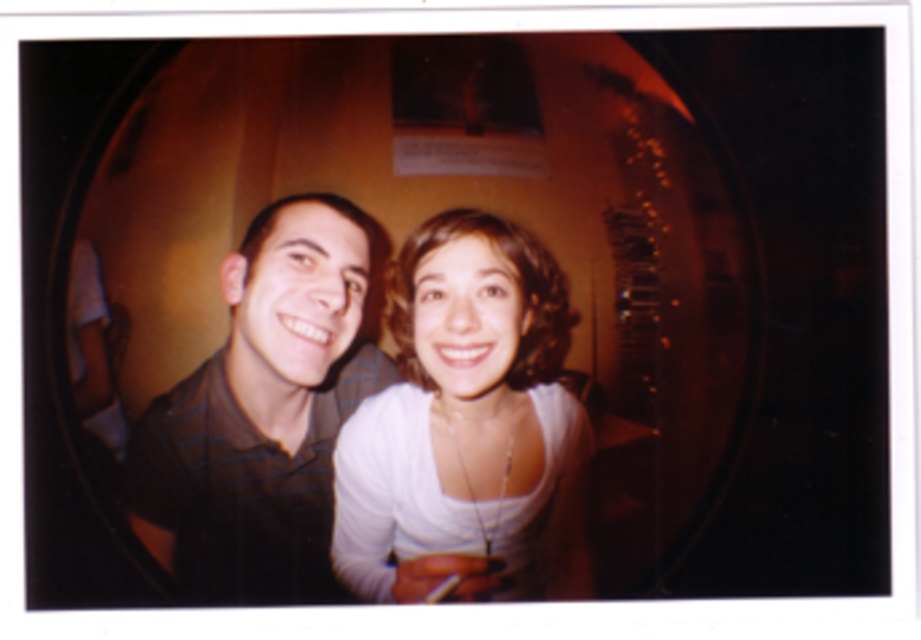
In the scene shown: Which is more to the left, white matte shirt at center or black striped shirt at center?

From the viewer's perspective, black striped shirt at center appears more on the left side.

Based on the photo, is white matte shirt at center thinner than black striped shirt at center?

Correct, white matte shirt at center's width is less than black striped shirt at center's.

The image size is (921, 640). Describe the element at coordinates (465, 426) in the screenshot. I see `white matte shirt at center` at that location.

Image resolution: width=921 pixels, height=640 pixels. What are the coordinates of `white matte shirt at center` in the screenshot? It's located at (465, 426).